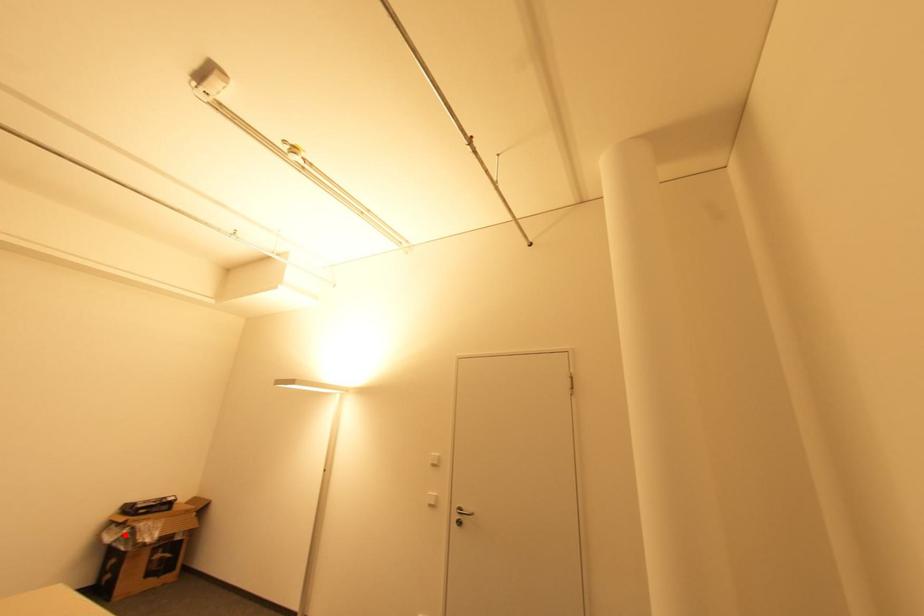
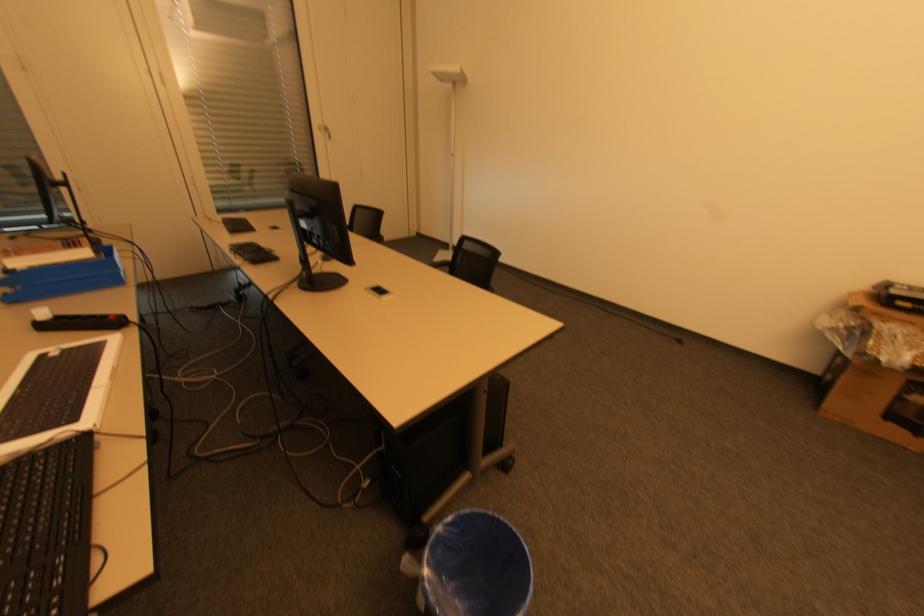
Question: I am providing you with two images of the same scene from different viewpoints. In image1, a red point is highlighted. Considering the same 3D point in image2, which of the following is correct?

Choices:
 (A) It is closer
 (B) It is farther

Answer: (A)